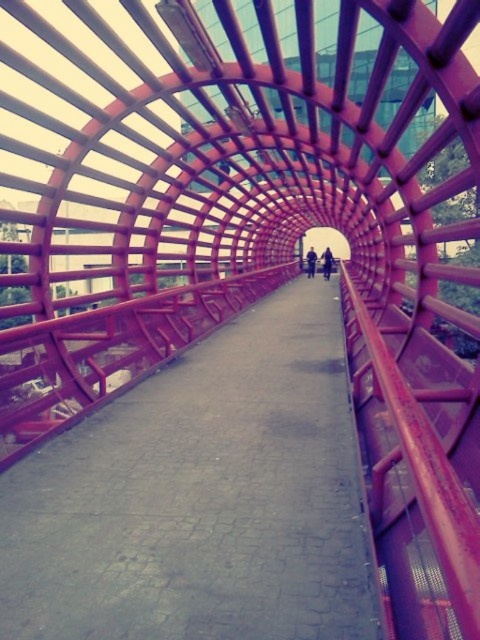
Can you confirm if dark blue jeans at center is shorter than dark blue jacket at center?

Indeed, dark blue jeans at center has a lesser height compared to dark blue jacket at center.

What do you see at coordinates (326, 262) in the screenshot? I see `dark blue jeans at center` at bounding box center [326, 262].

The height and width of the screenshot is (640, 480). Describe the element at coordinates (326, 262) in the screenshot. I see `dark blue jeans at center` at that location.

Find the location of `dark blue jeans at center`. dark blue jeans at center is located at coordinates (326, 262).

Is metallic pink walkway at center further to camera compared to dark blue jeans at center?

No, metallic pink walkway at center is in front of dark blue jeans at center.

Who is positioned more to the left, metallic pink walkway at center or dark blue jeans at center?

metallic pink walkway at center is more to the left.

Is point (120, 515) more distant than point (331, 266)?

No.

What are the coordinates of `metallic pink walkway at center` in the screenshot? It's located at (202, 497).

What do you see at coordinates (202, 497) in the screenshot?
I see `metallic pink walkway at center` at bounding box center [202, 497].

This screenshot has height=640, width=480. Identify the location of metallic pink walkway at center. (202, 497).